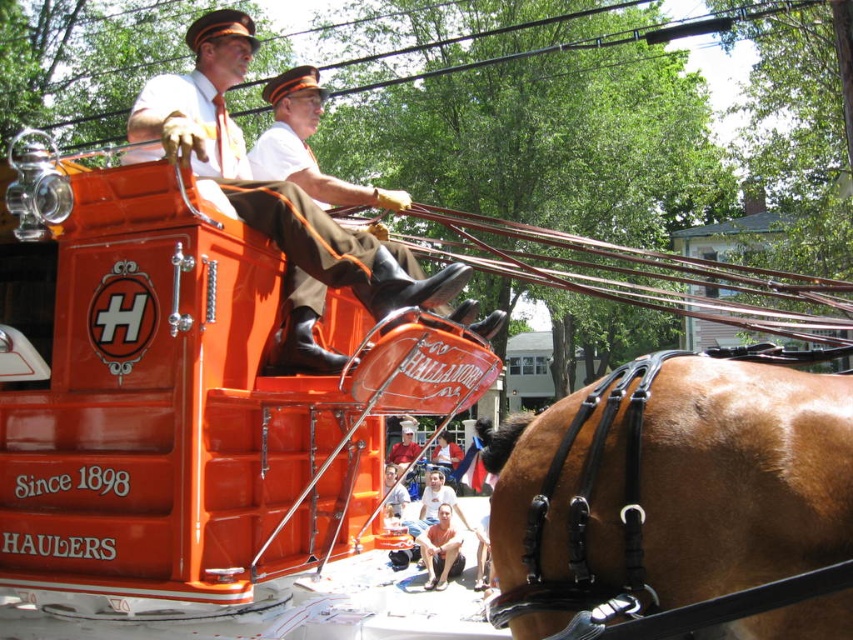
Question: Where is brown leather harness at center located in relation to smooth white shirt at center in the image?

Choices:
 (A) left
 (B) right

Answer: (B)

Question: Is black wire at upper center positioned in front of smooth white shirt at center?

Choices:
 (A) no
 (B) yes

Answer: (B)

Question: Can you confirm if black wire at upper center is wider than brown leather shorts at lower center?

Choices:
 (A) yes
 (B) no

Answer: (A)

Question: Which point is farther to the camera?

Choices:
 (A) smooth skin face at center
 (B) brown leather shorts at lower center
 (C) matte brown uniform at center

Answer: (A)

Question: Which of the following is the closest to the observer?

Choices:
 (A) smooth white shirt at center
 (B) brown leather harness at center

Answer: (B)

Question: Which object appears closest to the camera in this image?

Choices:
 (A) brown leather shorts at lower center
 (B) smooth white shirt at center

Answer: (A)